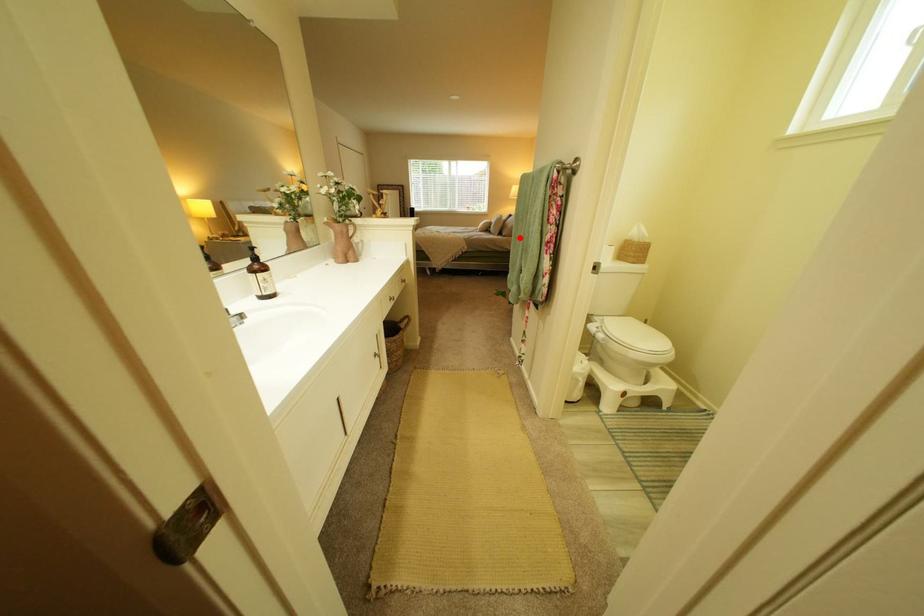
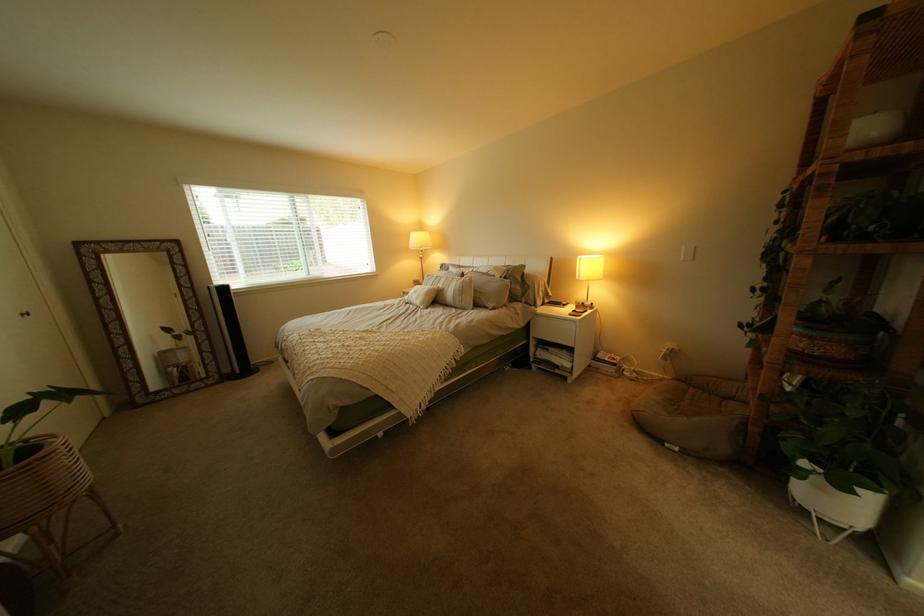
Locate, in the second image, the point that corresponds to the highlighted location in the first image.

(509, 310)